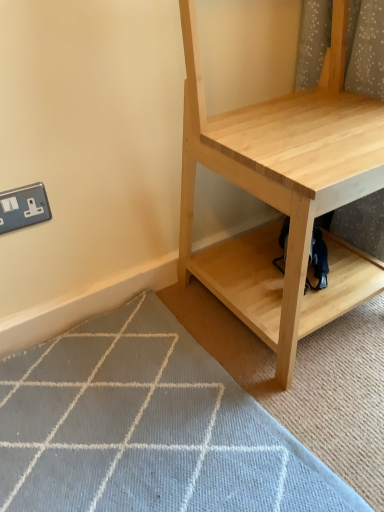
Question: Considering the relative sizes of silver metallic electric outlet at lower left and natural wood shelf at center in the image provided, is silver metallic electric outlet at lower left shorter than natural wood shelf at center?

Choices:
 (A) yes
 (B) no

Answer: (A)

Question: Considering the relative positions of silver metallic electric outlet at lower left and natural wood shelf at center in the image provided, is silver metallic electric outlet at lower left to the left of natural wood shelf at center from the viewer's perspective?

Choices:
 (A) no
 (B) yes

Answer: (B)

Question: Is silver metallic electric outlet at lower left positioned far away from natural wood shelf at center?

Choices:
 (A) no
 (B) yes

Answer: (A)

Question: Does silver metallic electric outlet at lower left have a greater height compared to natural wood shelf at center?

Choices:
 (A) yes
 (B) no

Answer: (B)

Question: Can we say silver metallic electric outlet at lower left lies outside natural wood shelf at center?

Choices:
 (A) yes
 (B) no

Answer: (A)

Question: Considering the positions of point (8, 197) and point (334, 121), is point (8, 197) closer or farther from the camera than point (334, 121)?

Choices:
 (A) closer
 (B) farther

Answer: (B)

Question: Relative to natural wood shelf at center, is silver metallic electric outlet at lower left in front or behind?

Choices:
 (A) front
 (B) behind

Answer: (B)

Question: From the image's perspective, is silver metallic electric outlet at lower left above or below natural wood shelf at center?

Choices:
 (A) above
 (B) below

Answer: (B)

Question: From a real-world perspective, is silver metallic electric outlet at lower left above or below natural wood shelf at center?

Choices:
 (A) above
 (B) below

Answer: (B)

Question: Looking at their shapes, would you say light gray woven mat at lower left is wider or thinner than dark blue fabric swivel chair at lower center?

Choices:
 (A) thin
 (B) wide

Answer: (B)

Question: Is point (51, 340) positioned closer to the camera than point (317, 249)?

Choices:
 (A) farther
 (B) closer

Answer: (B)

Question: In the image, is light gray woven mat at lower left positioned in front of or behind dark blue fabric swivel chair at lower center?

Choices:
 (A) behind
 (B) front

Answer: (B)

Question: Looking at the image, does light gray woven mat at lower left seem bigger or smaller compared to dark blue fabric swivel chair at lower center?

Choices:
 (A) big
 (B) small

Answer: (A)

Question: Is natural wood shelf at center spatially inside light gray woven mat at lower left, or outside of it?

Choices:
 (A) inside
 (B) outside

Answer: (B)

Question: Is natural wood shelf at center wider or thinner than light gray woven mat at lower left?

Choices:
 (A) thin
 (B) wide

Answer: (A)